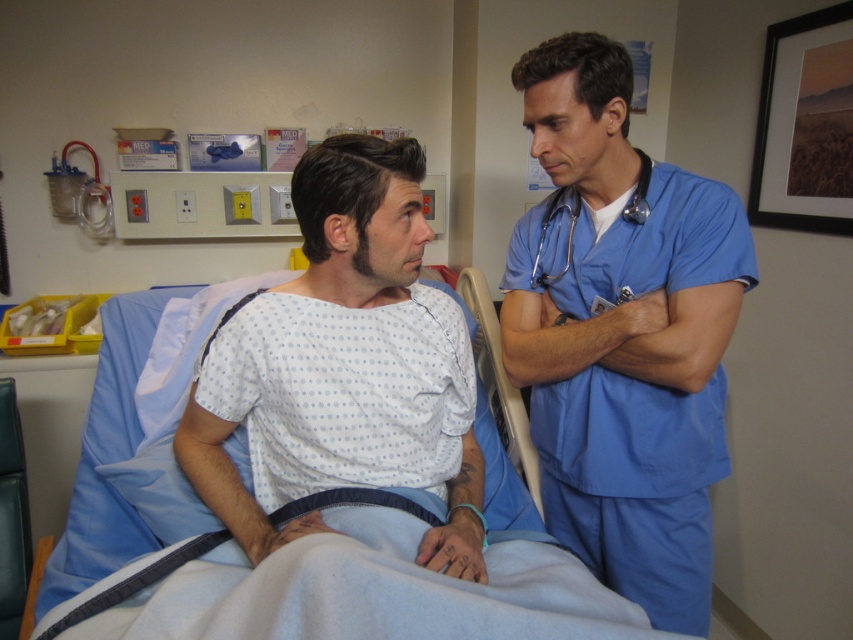
Question: Does blue scrubs at right appear over metallic blue stethoscope at upper right?

Choices:
 (A) yes
 (B) no

Answer: (B)

Question: Among these objects, which one is farthest from the camera?

Choices:
 (A) blue fabric hospital bed at center
 (B) white dotted hospital gown at center
 (C) metallic blue stethoscope at upper right
 (D) blue scrubs at right

Answer: (C)

Question: Considering the real-world distances, which object is farthest from the blue fabric hospital bed at center?

Choices:
 (A) white dotted hospital gown at center
 (B) metallic blue stethoscope at upper right

Answer: (B)

Question: Which object appears closest to the camera in this image?

Choices:
 (A) white dotted hospital gown at center
 (B) metallic blue stethoscope at upper right
 (C) blue fabric hospital bed at center
 (D) blue scrubs at right

Answer: (C)

Question: Does white dotted hospital gown at center appear on the left side of metallic blue stethoscope at upper right?

Choices:
 (A) no
 (B) yes

Answer: (B)

Question: Is blue fabric hospital bed at center behind metallic blue stethoscope at upper right?

Choices:
 (A) no
 (B) yes

Answer: (A)